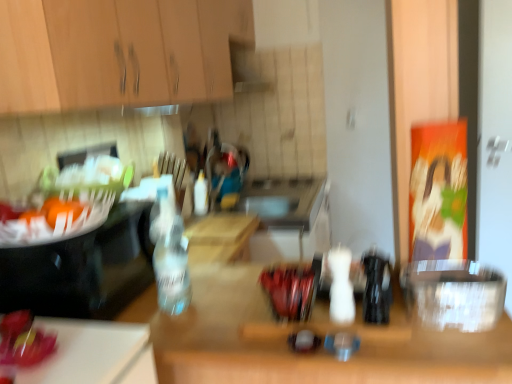
Measure the distance between shiny red apple at lower left and camera.

30.36 inches.

Where is `white matte bottle at center, placed as the second bottle when sorted from front to back`? This screenshot has height=384, width=512. white matte bottle at center, placed as the second bottle when sorted from front to back is located at coordinates (341, 286).

You are a GUI agent. You are given a task and a screenshot of the screen. Output one action in this format:
    pyautogui.click(x=<x>, y=<y>)
    Task: Click on the transparent plastic container at right, the second appliance positioned from the left
    
    Given the screenshot: What is the action you would take?
    click(453, 294)

How much space does clear glass bottle at left, placed as the 1th appliance when sorted from left to right, occupy vertically?

It is 9.88 inches.

This screenshot has width=512, height=384. Find the location of `shiny red apple at lower left`. shiny red apple at lower left is located at coordinates (23, 340).

Could you tell me if clear glass bottle at left, placed as the 1th appliance when sorted from left to right, is facing black plastic bottle at center, the 1th bottle when ordered from front to back?

Yes, clear glass bottle at left, placed as the 1th appliance when sorted from left to right, faces towards black plastic bottle at center, the 1th bottle when ordered from front to back.

Do you think clear glass bottle at left, which is the second appliance in right-to-left order, is within black plastic bottle at center, the 3th bottle when ordered from left to right, or outside of it?

clear glass bottle at left, which is the second appliance in right-to-left order, lies outside black plastic bottle at center, the 3th bottle when ordered from left to right.

How distant is clear glass bottle at left, placed as the 1th appliance when sorted from left to right, from black plastic bottle at center, which appears as the third bottle when viewed from the back?

27.73 inches.

Considering the sizes of clear glass bottle at left, which is the second appliance in right-to-left order, and black plastic bottle at center, which ranks as the first bottle in right-to-left order, in the image, is clear glass bottle at left, which is the second appliance in right-to-left order, wider or thinner than black plastic bottle at center, which ranks as the first bottle in right-to-left order,?

clear glass bottle at left, which is the second appliance in right-to-left order, is wider than black plastic bottle at center, which ranks as the first bottle in right-to-left order.

Which is less distant, (205, 197) or (115, 295)?

Point (205, 197) is positioned farther from the camera compared to point (115, 295).

Is white plastic bottle at center, arranged as the third bottle when viewed from the right, not within clear glass bottle at left, placed as the 1th appliance when sorted from left to right?

Yes, white plastic bottle at center, arranged as the third bottle when viewed from the right, is not within clear glass bottle at left, placed as the 1th appliance when sorted from left to right.

Looking at this image, looking at their sizes, would you say white plastic bottle at center, the 3th bottle from the front, is wider or thinner than clear glass bottle at left, placed as the 1th appliance when sorted from left to right?

white plastic bottle at center, the 3th bottle from the front, is thinner than clear glass bottle at left, placed as the 1th appliance when sorted from left to right.

From the image's perspective, which one is positioned lower, black plastic bottle at center, which ranks as the first bottle in right-to-left order, or white matte bottle at center, placed as the second bottle when sorted from front to back?

black plastic bottle at center, which ranks as the first bottle in right-to-left order, from the image's perspective.

Can you confirm if black plastic bottle at center, the 1th bottle when ordered from front to back, is bigger than white matte bottle at center, which is the 2th bottle in back-to-front order?

No.

Are black plastic bottle at center, which appears as the third bottle when viewed from the back, and white matte bottle at center, which is the 2th bottle in back-to-front order, beside each other?

Yes.

Is black plastic bottle at center, the 3th bottle when ordered from left to right, oriented towards white matte bottle at center, arranged as the 2th bottle when viewed from the left?

No, black plastic bottle at center, the 3th bottle when ordered from left to right, is not turned towards white matte bottle at center, arranged as the 2th bottle when viewed from the left.

Between wooden cabinet at upper left and clear glass bottle at left, which is the second appliance in right-to-left order, which one has more height?

Standing taller between the two is wooden cabinet at upper left.

Measure the distance between wooden cabinet at upper left and clear glass bottle at left, placed as the 1th appliance when sorted from left to right.

The distance of wooden cabinet at upper left from clear glass bottle at left, placed as the 1th appliance when sorted from left to right, is 19.37 inches.

Is the depth of wooden cabinet at upper left greater than that of clear glass bottle at left, which is the second appliance in right-to-left order?

No, it is not.

Where is `appliance to the left of wooden cabinet at upper left`? This screenshot has width=512, height=384. appliance to the left of wooden cabinet at upper left is located at coordinates coord(82,269).

Does clear glass bottle at left, placed as the 1th appliance when sorted from left to right, have a larger size compared to shiny red apple at lower left?

Indeed, clear glass bottle at left, placed as the 1th appliance when sorted from left to right, has a larger size compared to shiny red apple at lower left.

Does clear glass bottle at left, placed as the 1th appliance when sorted from left to right, appear on the right side of shiny red apple at lower left?

Correct, you'll find clear glass bottle at left, placed as the 1th appliance when sorted from left to right, to the right of shiny red apple at lower left.

Between clear glass bottle at left, placed as the 1th appliance when sorted from left to right, and shiny red apple at lower left, which one is positioned behind?

clear glass bottle at left, placed as the 1th appliance when sorted from left to right, is more distant.

From the image's perspective, does clear glass bottle at left, which is the second appliance in right-to-left order, appear lower than shiny red apple at lower left?

Actually, clear glass bottle at left, which is the second appliance in right-to-left order, appears above shiny red apple at lower left in the image.

From the image's perspective, is clear glass bottle at left, which is the second appliance in right-to-left order, over transparent plastic container at right, the second appliance positioned from the left?

Correct, clear glass bottle at left, which is the second appliance in right-to-left order, appears higher than transparent plastic container at right, the second appliance positioned from the left, in the image.

Which object is thinner, clear glass bottle at left, which is the second appliance in right-to-left order, or transparent plastic container at right, the second appliance positioned from the left?

With smaller width is transparent plastic container at right, the second appliance positioned from the left.

You are a GUI agent. You are given a task and a screenshot of the screen. Output one action in this format:
    pyautogui.click(x=<x>, y=<y>)
    Task: Click on the appliance to the left of transparent plastic container at right, which is the first appliance from right to left
    This screenshot has height=384, width=512.
    Given the screenshot: What is the action you would take?
    pyautogui.click(x=82, y=269)

At what (x,y) coordinates should I click in order to perform the action: click on food below the transparent plastic container at right, the second appliance positioned from the left (from the image's perspective). Please return your answer as a coordinate pair (x, y). Looking at the image, I should click on (23, 340).

Is shiny red apple at lower left not inside transparent plastic container at right, the second appliance positioned from the left?

Indeed, shiny red apple at lower left is completely outside transparent plastic container at right, the second appliance positioned from the left.

Looking at their sizes, would you say shiny red apple at lower left is wider or thinner than transparent plastic container at right, the second appliance positioned from the left?

shiny red apple at lower left is thinner than transparent plastic container at right, the second appliance positioned from the left.

Looking at the image, does shiny red apple at lower left seem bigger or smaller compared to transparent plastic container at right, which is the first appliance from right to left?

Clearly, shiny red apple at lower left is smaller in size than transparent plastic container at right, which is the first appliance from right to left.

In order to click on appliance above the black plastic bottle at center, the 1th bottle when ordered from front to back (from a real-world perspective) in this screenshot , I will do pyautogui.click(x=82, y=269).

Find the location of `bottle that appears behind the clear glass bottle at left, which is the second appliance in right-to-left order`. bottle that appears behind the clear glass bottle at left, which is the second appliance in right-to-left order is located at coordinates (201, 195).

Considering their positions, is transparent plastic container at right, which is the first appliance from right to left, positioned further to wooden table at center than white matte bottle at center, arranged as the 2th bottle when viewed from the left?

The object further to wooden table at center is white matte bottle at center, arranged as the 2th bottle when viewed from the left.

Based on their spatial positions, is white plastic bottle at center, arranged as the third bottle when viewed from the right, or wooden table at center further from black plastic bottle at center, the 3th bottle when ordered from left to right?

white plastic bottle at center, arranged as the third bottle when viewed from the right, lies further to black plastic bottle at center, the 3th bottle when ordered from left to right, than the other object.

Considering their positions, is clear glass bottle at left, placed as the 1th appliance when sorted from left to right, positioned further to white plastic bottle at center, which is the 1th bottle in left-to-right order, than white matte bottle at center, placed as the second bottle when sorted from front to back?

white matte bottle at center, placed as the second bottle when sorted from front to back.

Looking at the image, which one is located closer to black plastic bottle at center, which appears as the third bottle when viewed from the back, wooden table at center or white plastic bottle at center, which is the 1th bottle in left-to-right order?

wooden table at center lies closer to black plastic bottle at center, which appears as the third bottle when viewed from the back, than the other object.

Looking at the image, which one is located further to shiny red apple at lower left, black plastic bottle at center, which ranks as the first bottle in right-to-left order, or transparent plastic container at right, the second appliance positioned from the left?

transparent plastic container at right, the second appliance positioned from the left, is positioned further to the anchor shiny red apple at lower left.

Which object lies nearer to the anchor point white matte bottle at center, acting as the 2th bottle starting from the right, wooden table at center or wooden cabinet at upper left?

Among the two, wooden table at center is located nearer to white matte bottle at center, acting as the 2th bottle starting from the right.

Looking at the image, which one is located further to shiny red apple at lower left, wooden table at center or white matte bottle at center, placed as the second bottle when sorted from front to back?

The object further to shiny red apple at lower left is white matte bottle at center, placed as the second bottle when sorted from front to back.

Based on their spatial positions, is clear glass bottle at left, which is the second appliance in right-to-left order, or transparent plastic container at right, which is the first appliance from right to left, closer to wooden table at center?

Among the two, transparent plastic container at right, which is the first appliance from right to left, is located nearer to wooden table at center.

Where is `appliance between shiny red apple at lower left and transparent plastic container at right, which is the first appliance from right to left, from left to right`? The width and height of the screenshot is (512, 384). appliance between shiny red apple at lower left and transparent plastic container at right, which is the first appliance from right to left, from left to right is located at coordinates (82, 269).

This screenshot has height=384, width=512. Find the location of `bottle located between black plastic bottle at center, the 1th bottle when ordered from front to back, and white plastic bottle at center, which is counted as the 1th bottle, starting from the back, in the depth direction`. bottle located between black plastic bottle at center, the 1th bottle when ordered from front to back, and white plastic bottle at center, which is counted as the 1th bottle, starting from the back, in the depth direction is located at coordinates (341, 286).

At what (x,y) coordinates should I click in order to perform the action: click on appliance between shiny red apple at lower left and wooden table at center in the horizontal direction. Please return your answer as a coordinate pair (x, y). Looking at the image, I should click on (x=82, y=269).

Where is `bottle between white matte bottle at center, placed as the second bottle when sorted from front to back, and wooden table at center vertically`? bottle between white matte bottle at center, placed as the second bottle when sorted from front to back, and wooden table at center vertically is located at coordinates (376, 287).